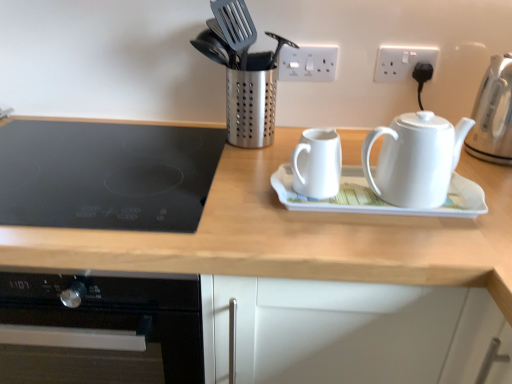
Locate an element on the screen. The image size is (512, 384). vacant space behind white glossy teapot at center, placed as the 3th kettle when sorted from right to left is located at coordinates (280, 148).